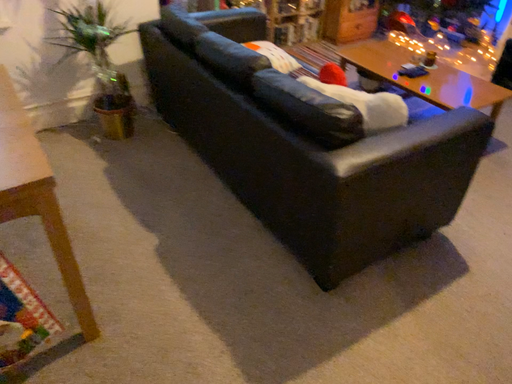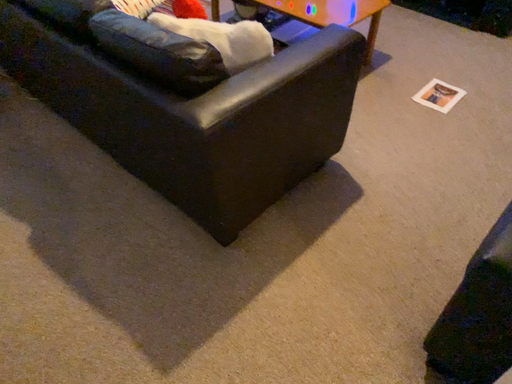
Question: Which way did the camera rotate in the video?

Choices:
 (A) rotated right
 (B) rotated left

Answer: (A)